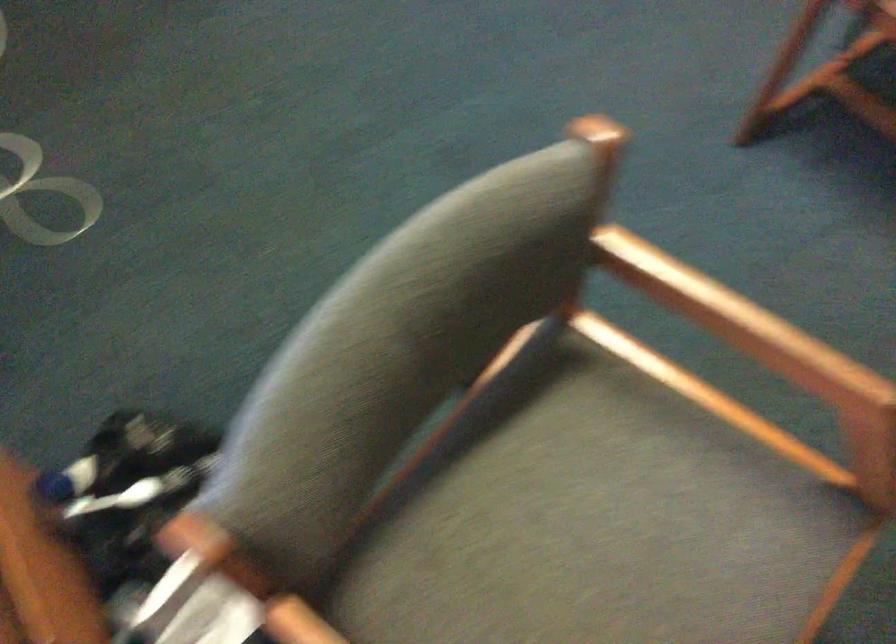
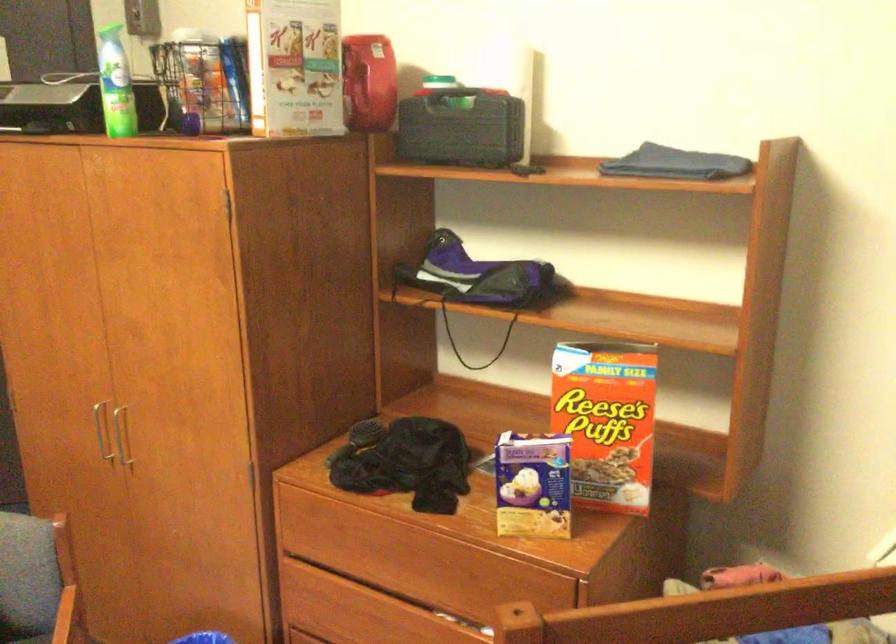
Question: The camera is either moving clockwise (left) or counter-clockwise (right) around the object. The first image is from the beginning of the video and the second image is from the end. Is the camera moving left or right when shooting the video?

Choices:
 (A) Left
 (B) Right

Answer: (A)